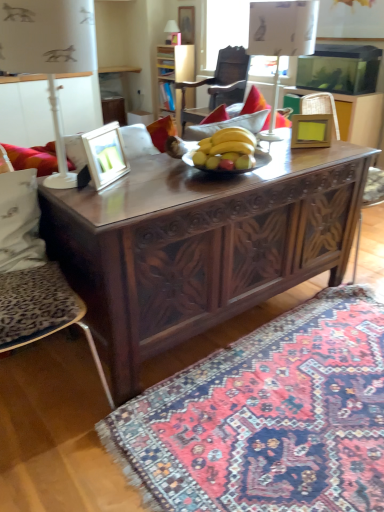
What are the coordinates of `free point behind matte wooden picture frame at left, the 1th picture frame positioned from the bottom` in the screenshot? It's located at (140, 161).